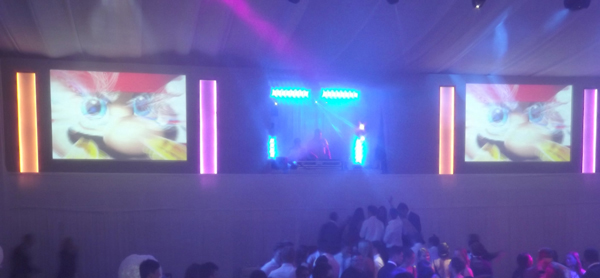
In order to click on screen in this screenshot , I will do `click(124, 125)`, `click(521, 129)`.